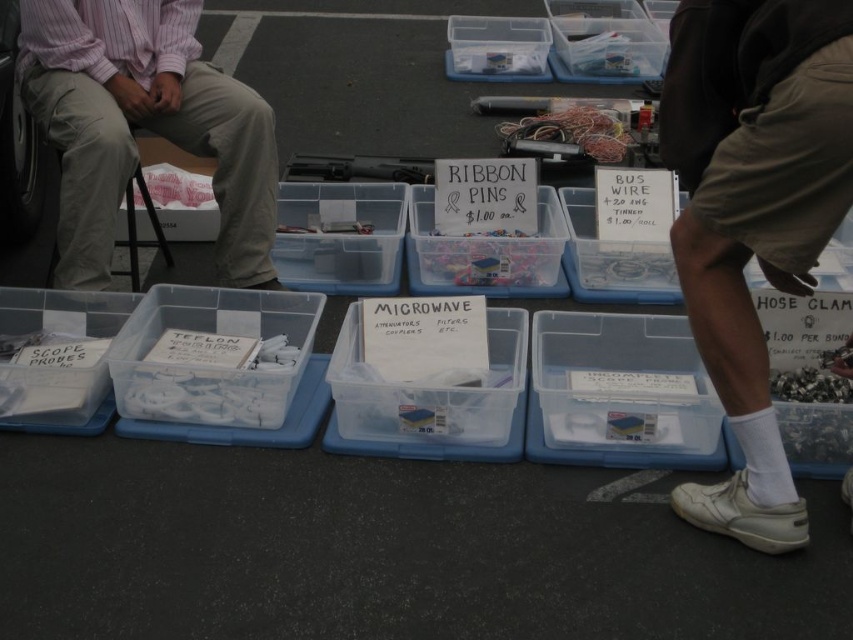
Which is behind, point (184, 291) or point (416, 252)?

Point (416, 252)

Does clear plastic box at center-left have a lesser width compared to translucent plastic ribbon pins at center?

Indeed, clear plastic box at center-left has a lesser width compared to translucent plastic ribbon pins at center.

The height and width of the screenshot is (640, 853). What are the coordinates of `clear plastic box at center-left` in the screenshot? It's located at (221, 369).

Is khaki pants at center shorter than clear plastic box at center?

Incorrect, khaki pants at center's height does not fall short of clear plastic box at center's.

How distant is khaki pants at center from clear plastic box at center?

A distance of 25.97 inches exists between khaki pants at center and clear plastic box at center.

Find the location of a particular element. The width and height of the screenshot is (853, 640). khaki pants at center is located at coordinates (143, 125).

Is white plastic scope probes at left smaller than clear plastic box at upper center?

Yes.

Between point (0, 355) and point (604, 44), which one is positioned behind?

Positioned behind is point (604, 44).

Describe the element at coordinates (57, 358) in the screenshot. I see `white plastic scope probes at left` at that location.

The height and width of the screenshot is (640, 853). I want to click on white plastic scope probes at left, so click(57, 358).